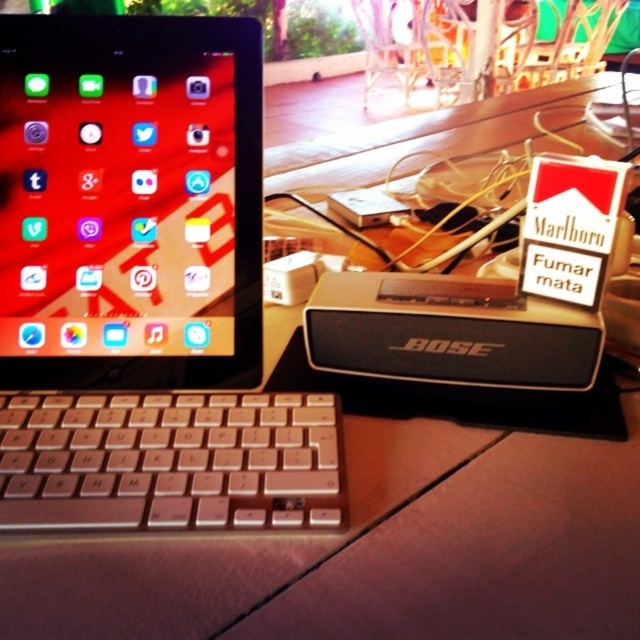
Which is behind, point (195, 378) or point (244, 413)?

Point (195, 378)

Can you confirm if silver metallic laptop at left is positioned to the left of silver metallic keyboard at lower left?

Indeed, silver metallic laptop at left is positioned on the left side of silver metallic keyboard at lower left.

Which is in front, point (240, 42) or point (317, 456)?

Point (317, 456)

You are a GUI agent. You are given a task and a screenshot of the screen. Output one action in this format:
    pyautogui.click(x=<x>, y=<y>)
    Task: Click on the silver metallic laptop at left
    The height and width of the screenshot is (640, 640).
    Given the screenshot: What is the action you would take?
    pyautogui.click(x=141, y=285)